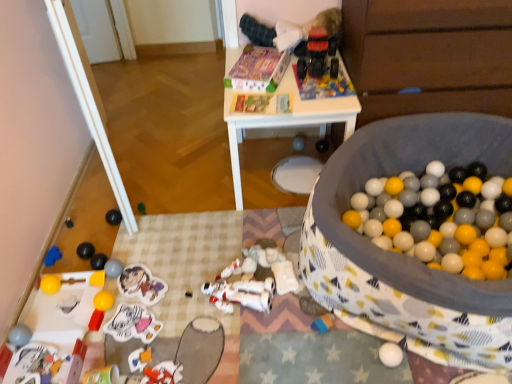
The width and height of the screenshot is (512, 384). In order to click on empty space that is in between matte cardboard stickers at lower center, which appears as the ninth toy when viewed from the right, and white matte robot at center, placed as the 7th toy when sorted from right to left in this screenshot , I will do `click(181, 289)`.